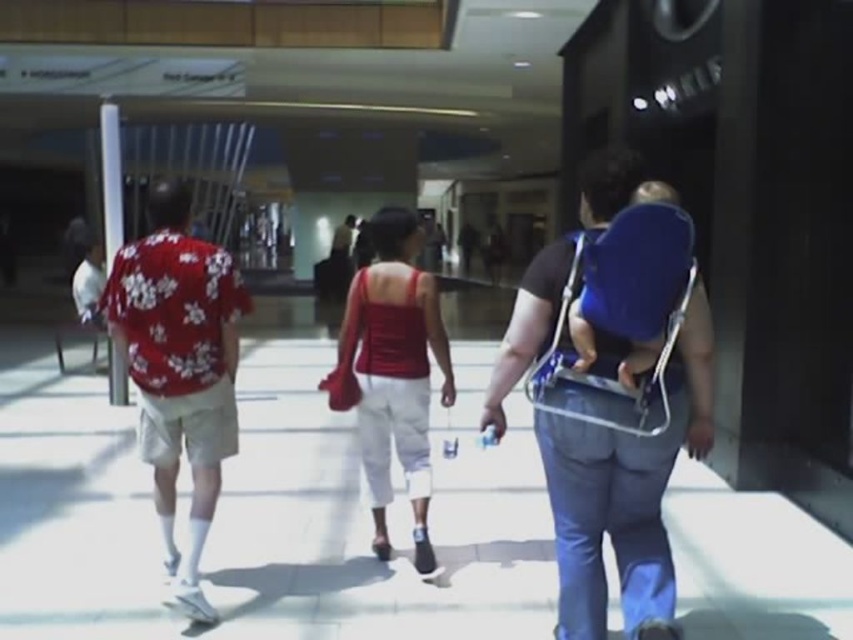
Can you confirm if blue fabric baby carrier at right is positioned below matte red tank top at center?

Actually, blue fabric baby carrier at right is above matte red tank top at center.

Where is `blue fabric baby carrier at right`? This screenshot has width=853, height=640. blue fabric baby carrier at right is located at coordinates (624, 497).

Can you confirm if blue fabric baby carrier at right is shorter than floral-patterned shirt at left?

No.

I want to click on blue fabric baby carrier at right, so click(624, 497).

This screenshot has width=853, height=640. I want to click on blue fabric baby carrier at right, so click(x=624, y=497).

Does floral-patterned shirt at left have a lesser width compared to matte red tank top at center?

Incorrect, floral-patterned shirt at left's width is not less than matte red tank top at center's.

Who is shorter, floral-patterned shirt at left or matte red tank top at center?

matte red tank top at center

At what (x,y) coordinates should I click in order to perform the action: click on floral-patterned shirt at left. Please return your answer as a coordinate pair (x, y). The image size is (853, 640). Looking at the image, I should click on (178, 368).